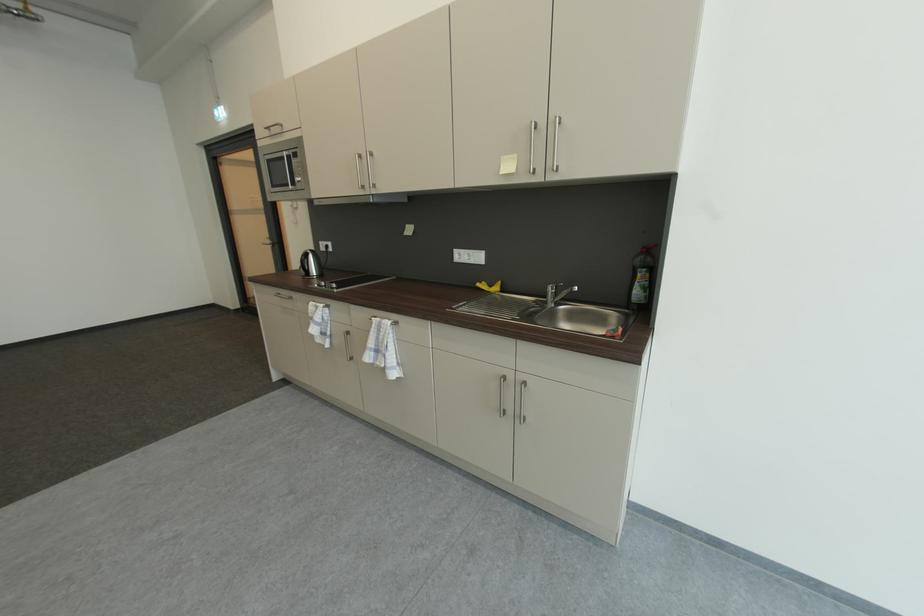
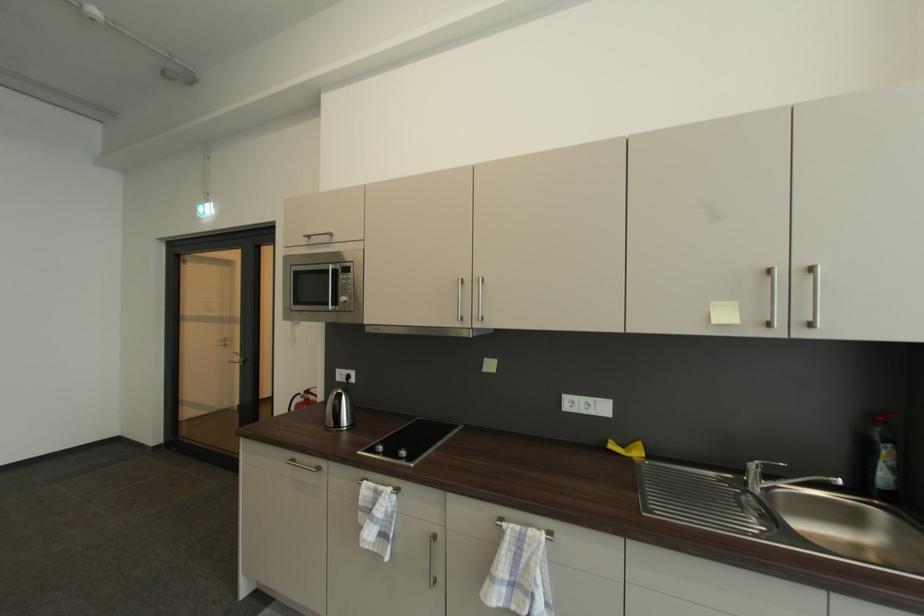
Locate, in the second image, the point that corresponds to point 295,187 in the first image.

(334, 306)